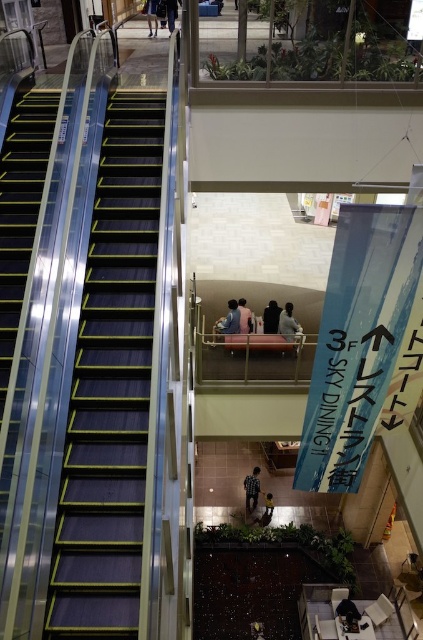
Who is more forward, (277, 328) or (269, 317)?

Point (277, 328) is in front.

Does light blue shirt at center appear over dark gray fabric jacket at center?

No.

Is point (288, 330) closer to viewer compared to point (269, 314)?

Yes, it is.

I want to click on light blue shirt at center, so click(288, 323).

Measure the distance between point (286,310) and camera.

A distance of 40.22 feet exists between point (286,310) and camera.

Is point (293, 323) positioned behind point (225, 324)?

No, (293, 323) is in front of (225, 324).

This screenshot has height=640, width=423. Identify the location of light blue shirt at center. pyautogui.click(x=288, y=323).

In the scene shown: Does metallic escalator steps at left have a smaller size compared to light blue shirt at center?

Yes, metallic escalator steps at left is smaller than light blue shirt at center.

Is point (115, 211) in front of point (290, 314)?

That is True.

The height and width of the screenshot is (640, 423). I want to click on metallic escalator steps at left, so click(x=110, y=387).